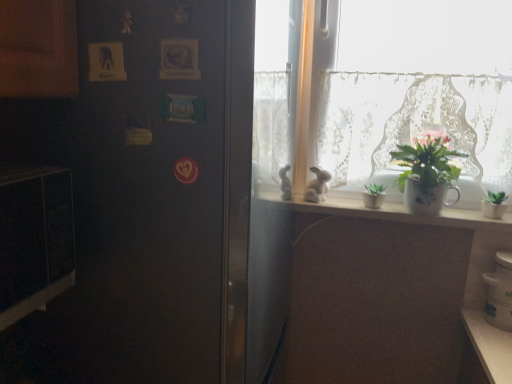
The height and width of the screenshot is (384, 512). What are the coordinates of `black matte microwave at left` in the screenshot? It's located at (34, 239).

I want to click on white lace curtain at upper right, so coord(399,118).

Where is `satin black refrigerator at left`? satin black refrigerator at left is located at coordinates (150, 190).

Where is `white matte rabbit at window`? white matte rabbit at window is located at coordinates (317, 186).

Find the location of a particular element. This screenshot has height=384, width=512. white wooden shelf at upper center is located at coordinates (392, 212).

This screenshot has width=512, height=384. In order to click on black matte microwave at left in this screenshot , I will do `click(34, 239)`.

Considering the relative sizes of satin black refrigerator at left and white glossy jar at lower right in the image provided, is satin black refrigerator at left shorter than white glossy jar at lower right?

No.

From the image's perspective, which object appears higher, satin black refrigerator at left or white glossy jar at lower right?

satin black refrigerator at left.

Is satin black refrigerator at left positioned with its back to white glossy jar at lower right?

No.

From a real-world perspective, is satin black refrigerator at left physically above white glossy jar at lower right?

Yes.

Can we say green matte plant at right lies outside white matte rabbit at window?

Yes.

Is the surface of green matte plant at right in direct contact with white matte rabbit at window?

green matte plant at right and white matte rabbit at window are clearly separated.

Considering the relative positions of green matte plant at right and white matte rabbit at window in the image provided, is green matte plant at right to the left or to the right of white matte rabbit at window?

Based on their positions, green matte plant at right is located to the right of white matte rabbit at window.

Which of these two, white lace curtain at upper right or white matte rabbit at window, is bigger?

Bigger between the two is white lace curtain at upper right.

The width and height of the screenshot is (512, 384). In order to click on curtain above the white matte rabbit at window (from a real-world perspective) in this screenshot , I will do `click(399, 118)`.

From the picture: From the image's perspective, which is below, white lace curtain at upper right or white matte rabbit at window?

white matte rabbit at window appears lower in the image.

Based on their sizes in the image, would you say green matte plant at right is bigger or smaller than white lace curtain at upper right?

Clearly, green matte plant at right is smaller in size than white lace curtain at upper right.

What's the angular difference between green matte plant at right and white lace curtain at upper right's facing directions?

The facing directions of green matte plant at right and white lace curtain at upper right are 1.27 degrees apart.

Identify the location of curtain above the green matte plant at right (from the image's perspective). The height and width of the screenshot is (384, 512). (399, 118).

Is green matte plant at right touching white lace curtain at upper right?

green matte plant at right and white lace curtain at upper right are clearly separated.

Does satin black refrigerator at left have a greater width compared to white wooden shelf at upper center?

Yes, satin black refrigerator at left is wider than white wooden shelf at upper center.

Looking at this image, could you tell me if satin black refrigerator at left is turned towards white wooden shelf at upper center?

Yes, satin black refrigerator at left is oriented towards white wooden shelf at upper center.

How different are the orientations of satin black refrigerator at left and white wooden shelf at upper center in degrees?

The angular difference between satin black refrigerator at left and white wooden shelf at upper center is 89.7 degrees.

Considering the relative sizes of white glossy jar at lower right and white wooden shelf at upper center in the image provided, is white glossy jar at lower right shorter than white wooden shelf at upper center?

No.

How distant is white glossy jar at lower right from white wooden shelf at upper center?

white glossy jar at lower right and white wooden shelf at upper center are 11.05 inches apart from each other.

The image size is (512, 384). What are the coordinates of `appliance in front of the white wooden shelf at upper center` in the screenshot? It's located at (499, 292).

In the scene shown: From the image's perspective, between white glossy jar at lower right and white wooden shelf at upper center, who is located below?

From the image's view, white glossy jar at lower right is below.

From a real-world perspective, is black matte microwave at left on satin black refrigerator at left?

Indeed, from a real-world perspective, black matte microwave at left stands above satin black refrigerator at left.

Would you say black matte microwave at left is outside satin black refrigerator at left?

Absolutely, black matte microwave at left is external to satin black refrigerator at left.

Can you see black matte microwave at left touching satin black refrigerator at left?

There is a gap between black matte microwave at left and satin black refrigerator at left.

Considering the sizes of objects black matte microwave at left and satin black refrigerator at left in the image provided, who is thinner, black matte microwave at left or satin black refrigerator at left?

black matte microwave at left is thinner.

In order to click on screen door on the left of white glossy jar at lower right in this screenshot , I will do 150,190.

Identify the location of rabbit that is behind the green matte plant at right. (317, 186).

Looking at the image, which one is located further to white wooden shelf at upper center, white lace curtain at upper right or white matte rabbit at window?

Among the two, white lace curtain at upper right is located further to white wooden shelf at upper center.

Looking at the image, which one is located further to white matte rabbit at window, green matte plant at right or white wooden shelf at upper center?

Based on the image, green matte plant at right appears to be further to white matte rabbit at window.

Considering their positions, is white glossy jar at lower right positioned closer to white matte rabbit at window than green matte plant at right?

Based on the image, green matte plant at right appears to be nearer to white matte rabbit at window.

Which object lies nearer to the anchor point green matte plant at right, white matte rabbit at window or white glossy jar at lower right?

The object closer to green matte plant at right is white matte rabbit at window.

When comparing their distances from satin black refrigerator at left, does white lace curtain at upper right or white wooden shelf at upper center seem further?

Based on the image, white lace curtain at upper right appears to be further to satin black refrigerator at left.

Based on their spatial positions, is green matte plant at right or white wooden shelf at upper center closer to white lace curtain at upper right?

Based on the image, green matte plant at right appears to be nearer to white lace curtain at upper right.

Estimate the real-world distances between objects in this image. Which object is further from satin black refrigerator at left, black matte microwave at left or white wooden shelf at upper center?

white wooden shelf at upper center.

Based on their spatial positions, is black matte microwave at left or green matte plant at right further from white matte rabbit at window?

black matte microwave at left lies further to white matte rabbit at window than the other object.

This screenshot has width=512, height=384. In order to click on curtain between satin black refrigerator at left and white glossy jar at lower right in this screenshot , I will do `click(399, 118)`.

At what (x,y) coordinates should I click in order to perform the action: click on window sill between green matte plant at right and white glossy jar at lower right in the up-down direction. Please return your answer as a coordinate pair (x, y). Looking at the image, I should click on (392, 212).

Find the location of `screen door between black matte microwave at left and white wooden shelf at upper center`. screen door between black matte microwave at left and white wooden shelf at upper center is located at coordinates (150, 190).

Find the location of a particular element. The image size is (512, 384). window sill between satin black refrigerator at left and white matte rabbit at window from front to back is located at coordinates (392, 212).